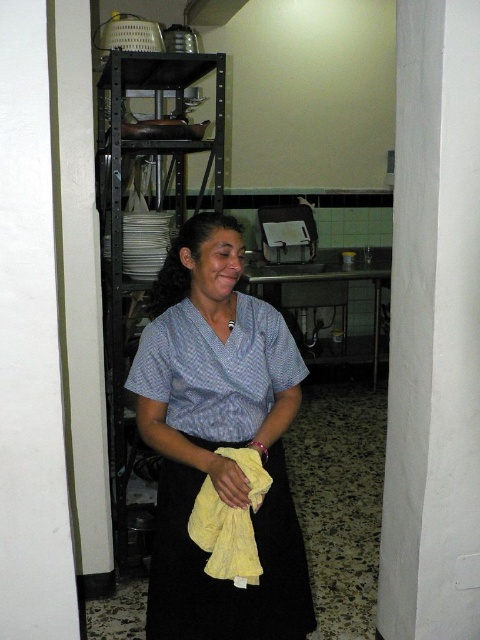
You are a robot in a kitchen. You need to choose between the yellow cotton towel at center and the yellow soft cloth at center to clean a spill. Which one is taller?

The yellow cotton towel at center is taller than the yellow soft cloth at center, so you should choose the yellow cotton towel at center.